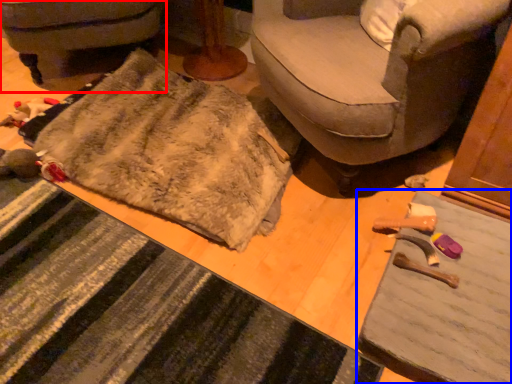
Question: Which object appears closest to the camera in this image, furniture (highlighted by a red box) or table (highlighted by a blue box)?

Choices:
 (A) furniture
 (B) table

Answer: (B)